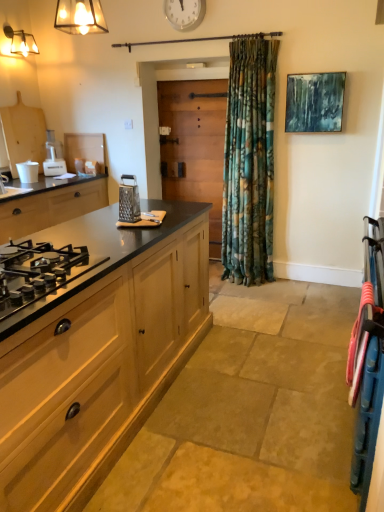
The image size is (384, 512). In order to click on free space above wooden at center (from a real-world perspective) in this screenshot , I will do `click(191, 82)`.